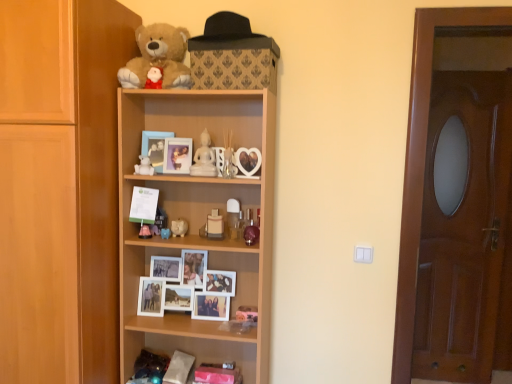
Question: Is matte white piggy bank at center, which ranks as the 3th toy in left-to-right order, to the left or to the right of white glossy figurine at upper center in the image?

Choices:
 (A) left
 (B) right

Answer: (A)

Question: From their relative heights in the image, would you say matte white piggy bank at center, which ranks as the 3th toy in left-to-right order, is taller or shorter than white glossy figurine at upper center?

Choices:
 (A) short
 (B) tall

Answer: (A)

Question: Based on their relative distances, which object is farther from the matte white piggy bank at center, arranged as the third toy when viewed from the right?

Choices:
 (A) white ceramic cat at center, arranged as the 2th toy when viewed from the right
 (B) white paper at middle
 (C) wooden cupboard at left
 (D) wooden shelf at center, the 1th shelf in the top-to-bottom sequence
 (E) matte white piggy bank at center, which is counted as the second toy, starting from the left

Answer: (C)

Question: Estimate the real-world distances between objects in this image. Which object is closer to the matte white piggy bank at center, which is counted as the second toy, starting from the left?

Choices:
 (A) matte wooden picture frame at center, the 1th picture frame viewed from the left
 (B) soft plush teddy bear at upper center
 (C) white glossy figurine at upper center
 (D) brown wooden door at right
 (E) white wooden photo frames at center, positioned as the 1th shelf in bottom-to-top order

Answer: (A)